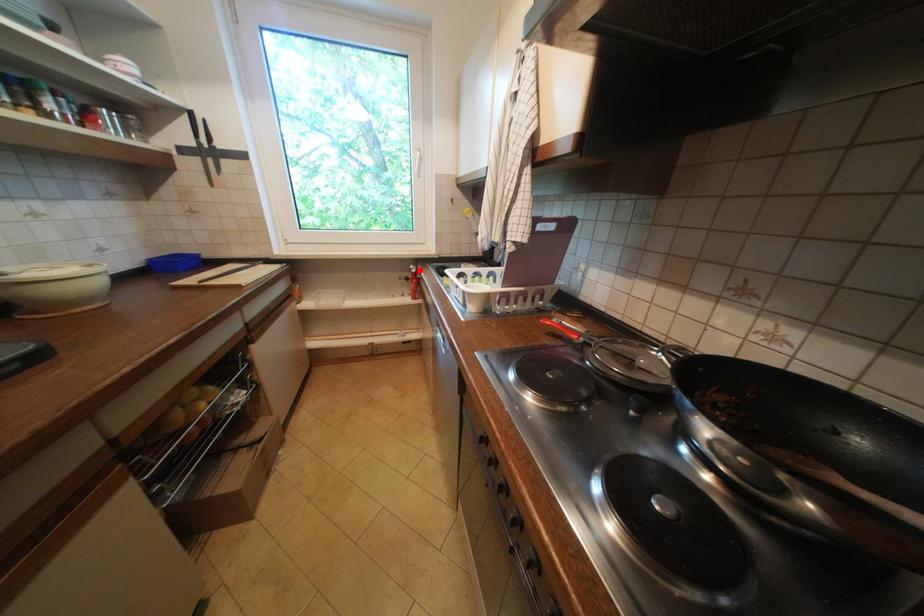
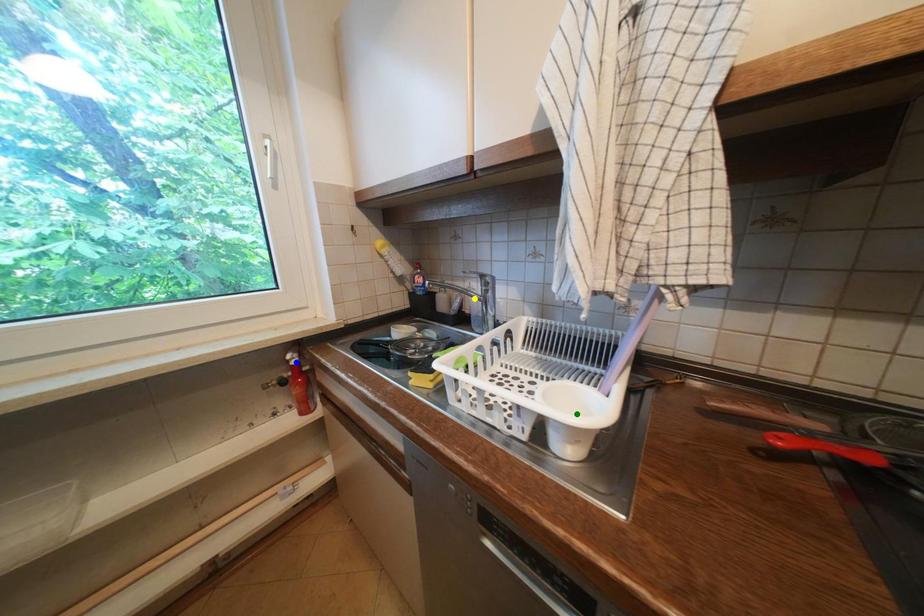
Question: I am providing you with two images of the same scene from different viewpoints. A red point is marked on the first image. You are given multiple points on the second image. Can you choose the point in image 2 that corresponds to the point in image 1?

Choices:
 (A) blue point
 (B) green point
 (C) yellow point

Answer: (A)